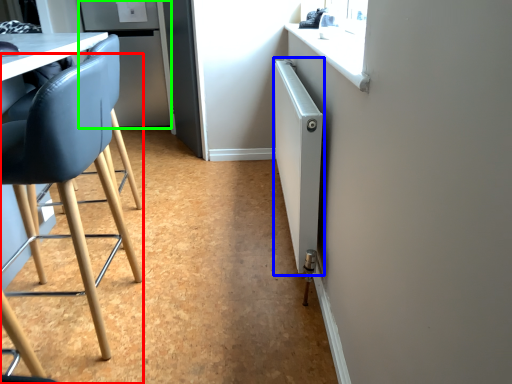
Question: Estimate the real-world distances between objects in this image. Which object is closer to chair (highlighted by a red box), radiator (highlighted by a blue box) or fridge (highlighted by a green box)?

Choices:
 (A) radiator
 (B) fridge

Answer: (A)